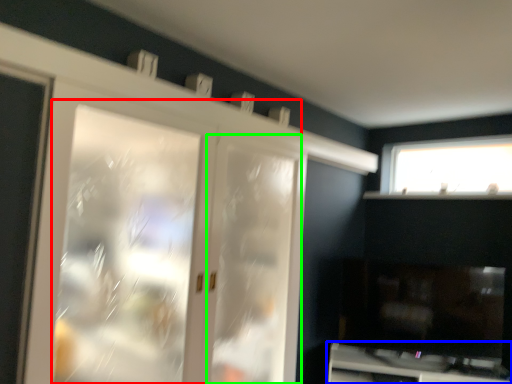
Question: Which object is positioned farthest from screen door (highlighted by a red box)? Select from cabinetry (highlighted by a blue box) and screen door (highlighted by a green box).

Choices:
 (A) cabinetry
 (B) screen door

Answer: (A)